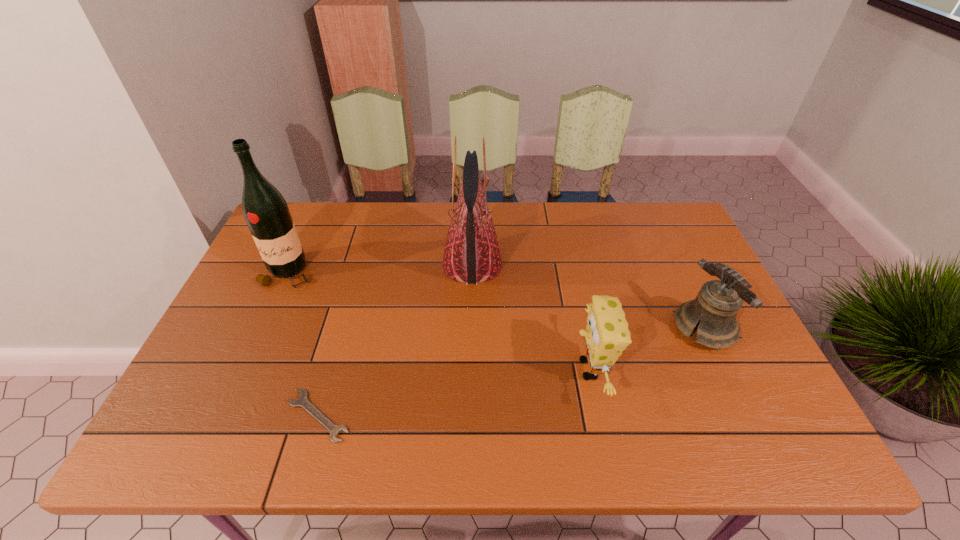
Locate an element on the screen. The width and height of the screenshot is (960, 540). vacant space located 0.320m on the face of the second object from right to left is located at coordinates (438, 369).

The image size is (960, 540). Find the location of `free space located on the face of the second object from right to left`. free space located on the face of the second object from right to left is located at coordinates (463, 369).

Identify the location of free space located on the back of the wrench. The height and width of the screenshot is (540, 960). (345, 321).

I want to click on object present at the far edge, so click(x=471, y=255).

Where is `sponge present at the near edge`? sponge present at the near edge is located at coordinates (606, 335).

The image size is (960, 540). What are the coordinates of `wrench at the near edge` in the screenshot? It's located at (302, 401).

At what (x,y) coordinates should I click in order to perform the action: click on object at the left edge. Please return your answer as a coordinate pair (x, y). Image resolution: width=960 pixels, height=540 pixels. Looking at the image, I should click on (265, 210).

Image resolution: width=960 pixels, height=540 pixels. Identify the location of object situated at the right edge. (718, 302).

You are a GUI agent. You are given a task and a screenshot of the screen. Output one action in this format:
    pyautogui.click(x=<x>, y=<y>)
    Task: Click on the free space at the far edge of the desktop
    This screenshot has height=540, width=960.
    Given the screenshot: What is the action you would take?
    pyautogui.click(x=522, y=207)

I want to click on vacant space at the near edge of the desktop, so click(678, 435).